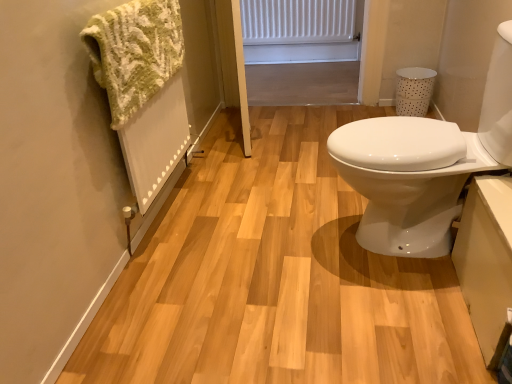
Locate an element on the screen. vacant area that is in front of white glossy sink at right is located at coordinates (404, 319).